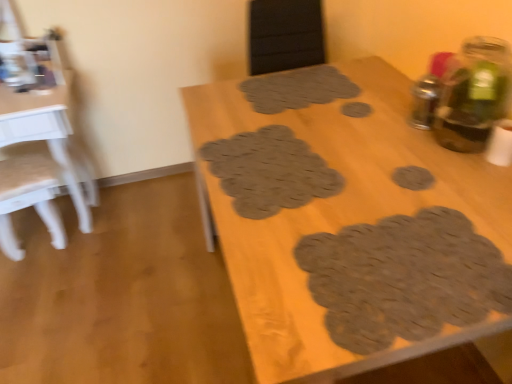
This screenshot has width=512, height=384. Find the location of `free space in front of brown felt coaster at center, which ranks as the 4th footprint in bottom-to-top order`. free space in front of brown felt coaster at center, which ranks as the 4th footprint in bottom-to-top order is located at coordinates (377, 140).